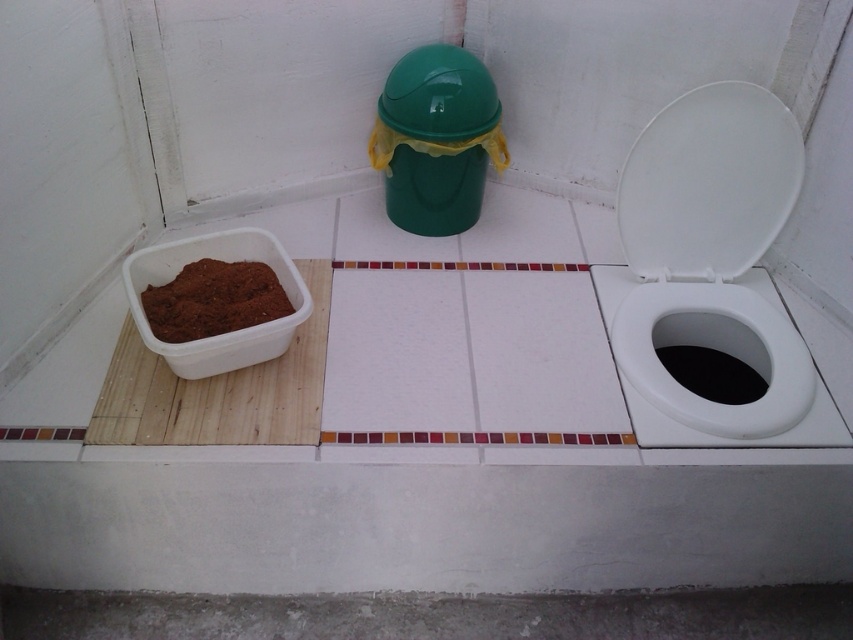
This screenshot has width=853, height=640. What do you see at coordinates (692, 392) in the screenshot?
I see `white glossy toilet bowl at lower right` at bounding box center [692, 392].

Is point (756, 422) positioned in front of point (418, 70)?

Yes, it is in front of point (418, 70).

Which is in front, point (747, 296) or point (392, 124)?

Point (747, 296)

The image size is (853, 640). Find the location of `white glossy toilet bowl at lower right`. white glossy toilet bowl at lower right is located at coordinates (692, 392).

Who is higher up, white glossy toilet lid at upper right or green matte trash can lid at upper center?

Positioned higher is green matte trash can lid at upper center.

Is point (769, 216) positioned before point (432, 140)?

Yes, point (769, 216) is closer to viewer.

Which is in front, point (764, 184) or point (399, 113)?

Point (764, 184) is in front.

Identify the location of white glossy toilet lid at upper right. (709, 182).

Is white glossy toilet lid at upper right wider than white glossy toilet bowl at lower right?

Incorrect, white glossy toilet lid at upper right's width does not surpass white glossy toilet bowl at lower right's.

From the picture: Who is higher up, white glossy toilet lid at upper right or white glossy toilet bowl at lower right?

white glossy toilet lid at upper right is above.

Who is more forward, (689, 252) or (793, 381)?

Point (793, 381)

Identify the location of white glossy toilet lid at upper right. (709, 182).